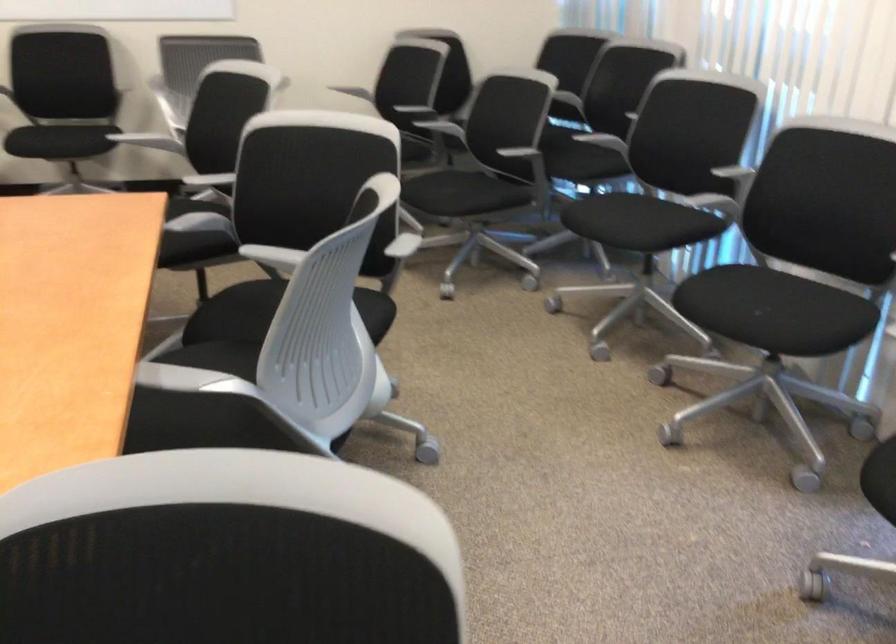
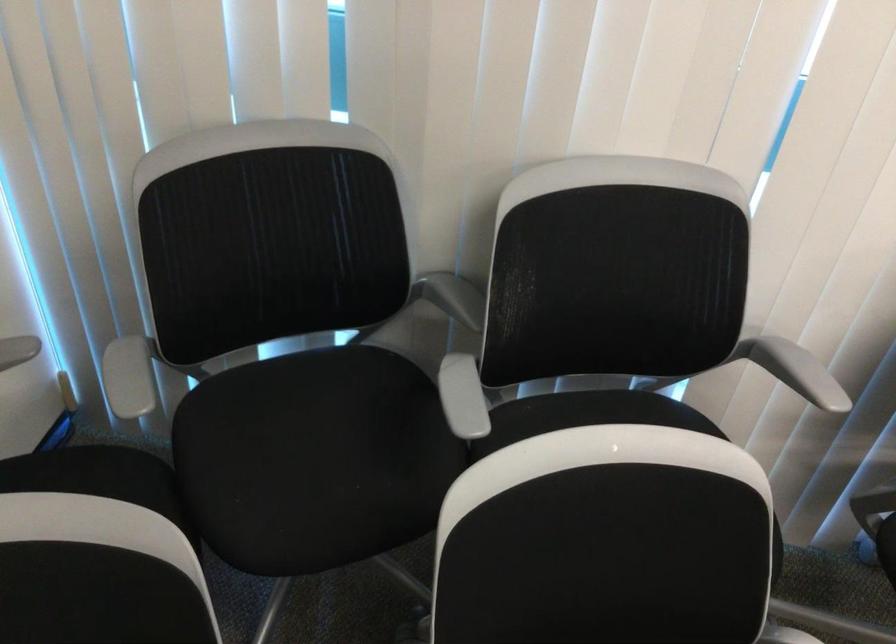
The point at (605, 84) is marked in the first image. Where is the corresponding point in the second image?

(453, 297)